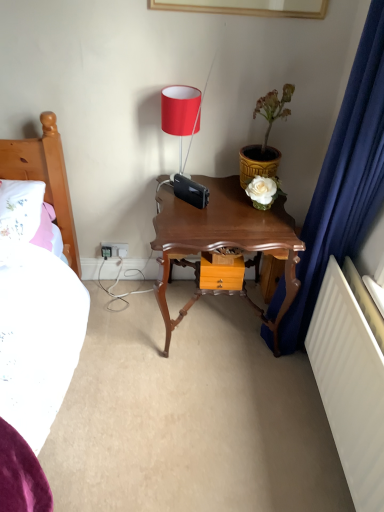
Measure the distance between point (197,127) and camera.

Point (197,127) and camera are 6.01 feet apart.

What is the approximate width of yellow textured pot at upper right?

22.58 centimeters.

Where is `white plastic electrical outlet at lower left`? The height and width of the screenshot is (512, 384). white plastic electrical outlet at lower left is located at coordinates (113, 249).

Identify the location of matte red lampshade at upper center. This screenshot has height=512, width=384. (180, 113).

The width and height of the screenshot is (384, 512). Find the location of `electric outlet that appears below the wooden drawer at center (from a real-world perspective)`. electric outlet that appears below the wooden drawer at center (from a real-world perspective) is located at coordinates (113, 249).

Can you confirm if wooden drawer at center is thinner than white plastic electrical outlet at lower left?

Incorrect, the width of wooden drawer at center is not less than that of white plastic electrical outlet at lower left.

From the image's perspective, is wooden drawer at center over white plastic electrical outlet at lower left?

Incorrect, from the image's perspective, wooden drawer at center is lower than white plastic electrical outlet at lower left.

Is shiny brown wooden nightstand at center at the right side of wooden drawer at center?

No, shiny brown wooden nightstand at center is not to the right of wooden drawer at center.

Locate an element on the screen. Image resolution: width=384 pixels, height=512 pixels. drawer above the shiny brown wooden nightstand at center (from a real-world perspective) is located at coordinates click(x=221, y=274).

Between point (290, 300) and point (213, 268), which one is positioned in front?

The point (290, 300) is closer to the camera.

Which of these two, shiny brown wooden nightstand at center or wooden drawer at center, is thinner?

wooden drawer at center.

Could you tell me if wooden drawer at center is facing matte red lampshade at upper center?

No, wooden drawer at center is not turned towards matte red lampshade at upper center.

Which of these two, wooden drawer at center or matte red lampshade at upper center, is smaller?

wooden drawer at center is smaller.

Locate an element on the screen. The image size is (384, 512). drawer below the matte red lampshade at upper center (from a real-world perspective) is located at coordinates (221, 274).

In the image, is white plastic electrical outlet at lower left on the left side or the right side of wooden drawer at center?

From the image, it's evident that white plastic electrical outlet at lower left is to the left of wooden drawer at center.

From a real-world perspective, is white plastic electrical outlet at lower left on top of wooden drawer at center?

No.

From the picture: Is white plastic electrical outlet at lower left not near wooden drawer at center?

white plastic electrical outlet at lower left is near wooden drawer at center, not far away.

I want to click on electric outlet that is under the wooden drawer at center (from a real-world perspective), so click(113, 249).

Considering their positions, is yellow textured pot at upper right located in front of or behind white plastic electrical outlet at lower left?

In the image, yellow textured pot at upper right appears in front of white plastic electrical outlet at lower left.

Looking at this image, from a real-world perspective, is yellow textured pot at upper right beneath white plastic electrical outlet at lower left?

No, from a real-world perspective, yellow textured pot at upper right is not under white plastic electrical outlet at lower left.

From the picture: Is yellow textured pot at upper right looking in the opposite direction of white plastic electrical outlet at lower left?

No, yellow textured pot at upper right is not facing away from white plastic electrical outlet at lower left.

The image size is (384, 512). I want to click on electric outlet behind the yellow textured pot at upper right, so click(x=113, y=249).

Does wooden drawer at center appear on the left side of shiny brown wooden nightstand at center?

No.

This screenshot has width=384, height=512. In order to click on nightstand that is under the wooden drawer at center (from a real-world perspective) in this screenshot , I will do `click(223, 239)`.

From the image's perspective, is wooden drawer at center beneath shiny brown wooden nightstand at center?

No, from the image's perspective, wooden drawer at center is not below shiny brown wooden nightstand at center.

Is wooden drawer at center facing towards shiny brown wooden nightstand at center?

Yes, wooden drawer at center is aimed at shiny brown wooden nightstand at center.

From a real-world perspective, relative to shiny brown wooden nightstand at center, is white plastic electrical outlet at lower left vertically above or below?

In terms of real-world spatial position, white plastic electrical outlet at lower left is below shiny brown wooden nightstand at center.

Looking at this image, which is nearer, (111, 248) or (167, 231)?

The point (167, 231) is in front.

Who is taller, white plastic electrical outlet at lower left or shiny brown wooden nightstand at center?

Standing taller between the two is shiny brown wooden nightstand at center.

Based on their positions, is white plastic electrical outlet at lower left located to the left or right of shiny brown wooden nightstand at center?

Based on their positions, white plastic electrical outlet at lower left is located to the left of shiny brown wooden nightstand at center.

You are a GUI agent. You are given a task and a screenshot of the screen. Output one action in this format:
    pyautogui.click(x=<x>, y=<y>)
    Task: Click on the drawer on the right of white plastic electrical outlet at lower left
    The width and height of the screenshot is (384, 512).
    Given the screenshot: What is the action you would take?
    pyautogui.click(x=221, y=274)

I want to click on drawer above the shiny brown wooden nightstand at center (from the image's perspective), so [x=221, y=274].

Based on their spatial positions, is wooden drawer at center or yellow textured pot at upper right further from matte red lampshade at upper center?

wooden drawer at center.

From the image, which object appears to be farther from matte red lampshade at upper center, shiny brown wooden nightstand at center or white plastic electrical outlet at lower left?

Among the two, white plastic electrical outlet at lower left is located further to matte red lampshade at upper center.

Based on their spatial positions, is white plastic electrical outlet at lower left or shiny brown wooden nightstand at center further from yellow textured pot at upper right?

Based on the image, white plastic electrical outlet at lower left appears to be further to yellow textured pot at upper right.

Based on their spatial positions, is shiny brown wooden nightstand at center or wooden drawer at center further from yellow textured pot at upper right?

The object further to yellow textured pot at upper right is wooden drawer at center.

Which object lies further to the anchor point yellow textured pot at upper right, wooden drawer at center or shiny brown wooden nightstand at center?

wooden drawer at center lies further to yellow textured pot at upper right than the other object.

Which object lies nearer to the anchor point shiny brown wooden nightstand at center, white plastic electrical outlet at lower left or wooden drawer at center?

Based on the image, wooden drawer at center appears to be nearer to shiny brown wooden nightstand at center.

When comparing their distances from wooden drawer at center, does shiny brown wooden nightstand at center or white plastic electrical outlet at lower left seem further?

white plastic electrical outlet at lower left is positioned further to the anchor wooden drawer at center.

From the picture: Looking at the image, which one is located closer to shiny brown wooden nightstand at center, matte red lampshade at upper center or white plastic electrical outlet at lower left?

matte red lampshade at upper center is positioned closer to the anchor shiny brown wooden nightstand at center.

Identify the location of drawer that lies between yellow textured pot at upper right and shiny brown wooden nightstand at center from top to bottom. (221, 274).

Where is `houseplant between matte red lampshade at upper center and wooden drawer at center in the up-down direction`? houseplant between matte red lampshade at upper center and wooden drawer at center in the up-down direction is located at coordinates (265, 137).

Where is `drawer between shiny brown wooden nightstand at center and white plastic electrical outlet at lower left along the z-axis`? This screenshot has width=384, height=512. drawer between shiny brown wooden nightstand at center and white plastic electrical outlet at lower left along the z-axis is located at coordinates (221, 274).

I want to click on houseplant located between shiny brown wooden nightstand at center and white plastic electrical outlet at lower left in the depth direction, so click(265, 137).